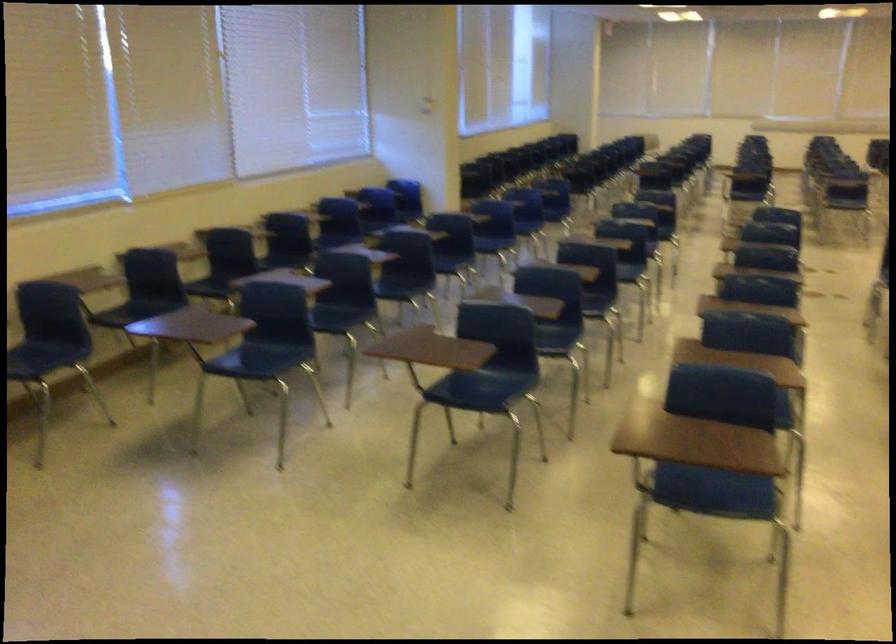
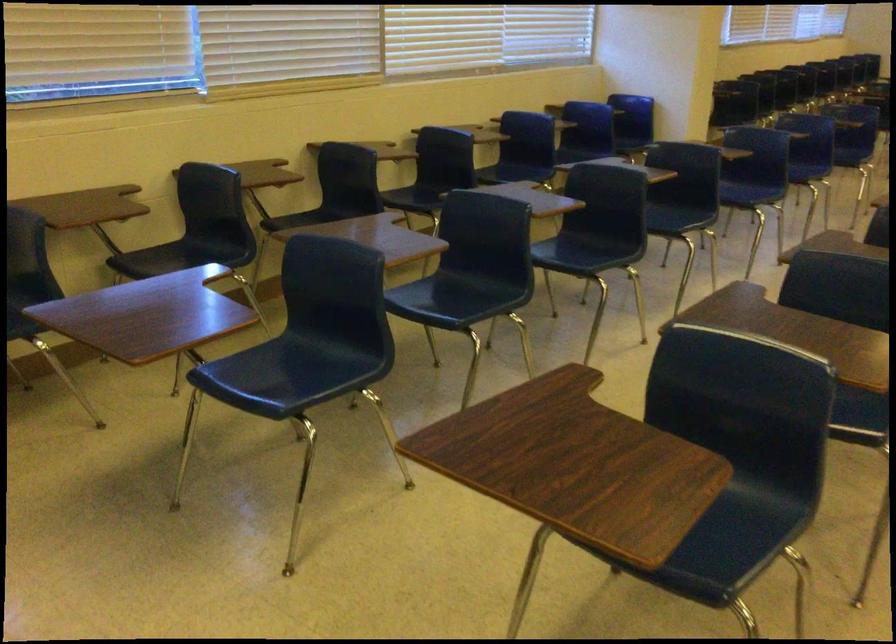
Locate, in the second image, the point that corresponds to the point at 407,285 in the first image.

(586, 252)